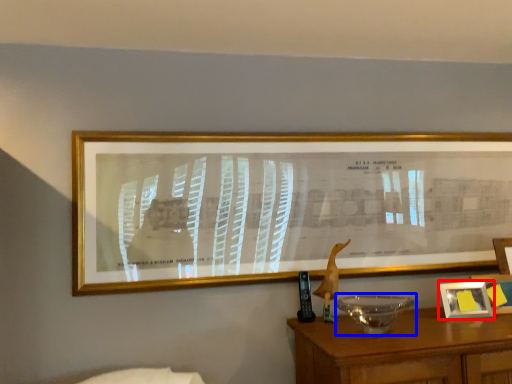
Question: Which object is closer to the camera taking this photo, picture frame (highlighted by a red box) or glass bowl (highlighted by a blue box)?

Choices:
 (A) picture frame
 (B) glass bowl

Answer: (B)